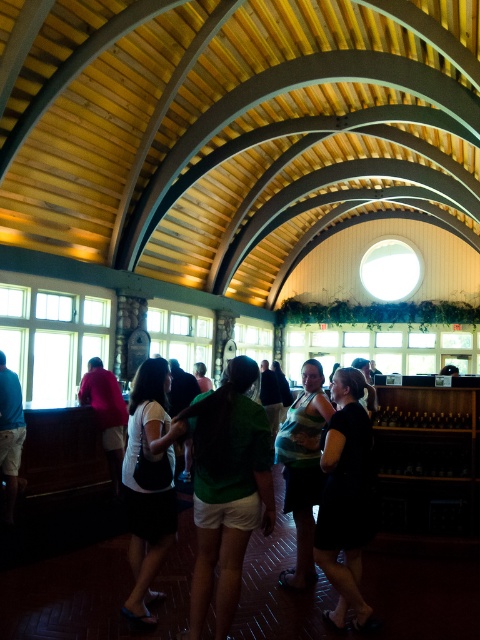
You are a fashion designer who needs to decide which garment to display in a narrow showcase. The showcase is only wide enough for one item. Given the black matte dress at center and the matte pink shirt at center, which one would you choose to fit better in the showcase?

The black matte dress at center is thinner than the matte pink shirt at center, so it would fit better in the narrow showcase.

You are organizing a clothing display in the building shown. You have two shirts on a rack at the center of the room. The white matte shirt at center and the matte pink shirt at center. Which shirt should you place on the higher hanger to ensure they are displayed at the same height?

The white matte shirt at center is taller than the matte pink shirt at center. To display them at the same height, place the white matte shirt at center on a lower hanger and the matte pink shirt at center on a higher hanger so that their tops align.

You are standing in the building and see two points marked on the floor. The first point is at position point [166,538] and the second is at point [12,467]. If you want to reach the point that is closer to you, which one should you walk towards?

You should walk towards point [166,538] because it is closer to the viewer than point [12,467].